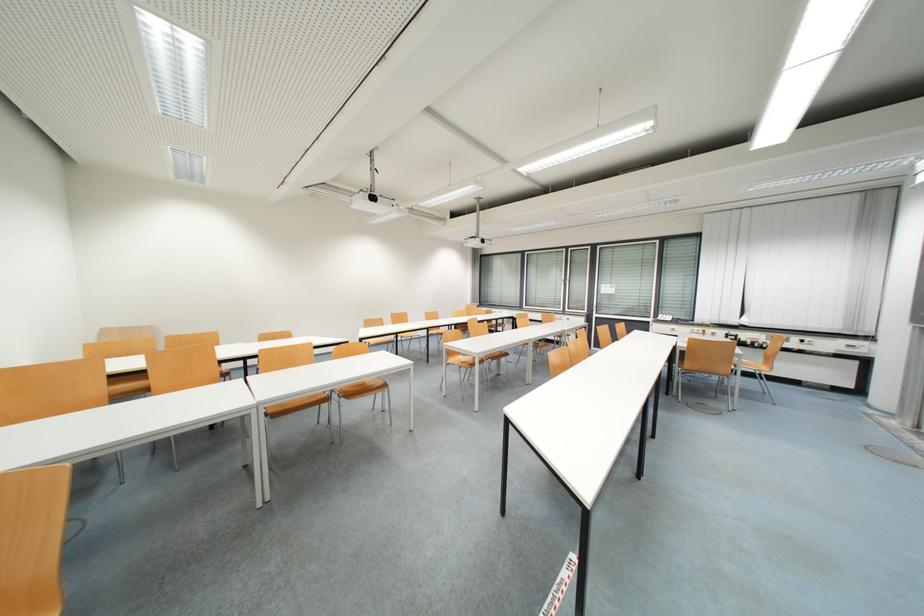
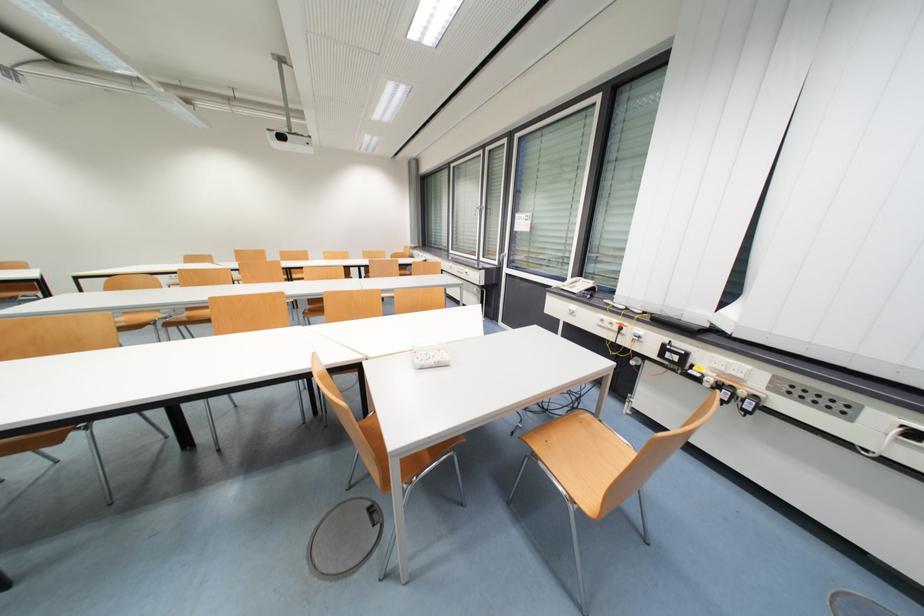
The point at (706, 331) is marked in the first image. Where is the corresponding point in the second image?

(622, 323)